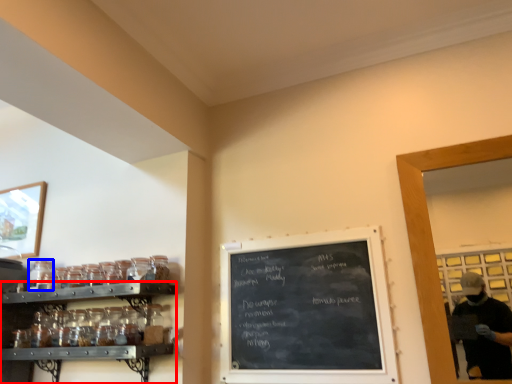
Question: Which point is further to the camera, shelf (highlighted by a red box) or glass jar (highlighted by a blue box)?

Choices:
 (A) shelf
 (B) glass jar

Answer: (B)